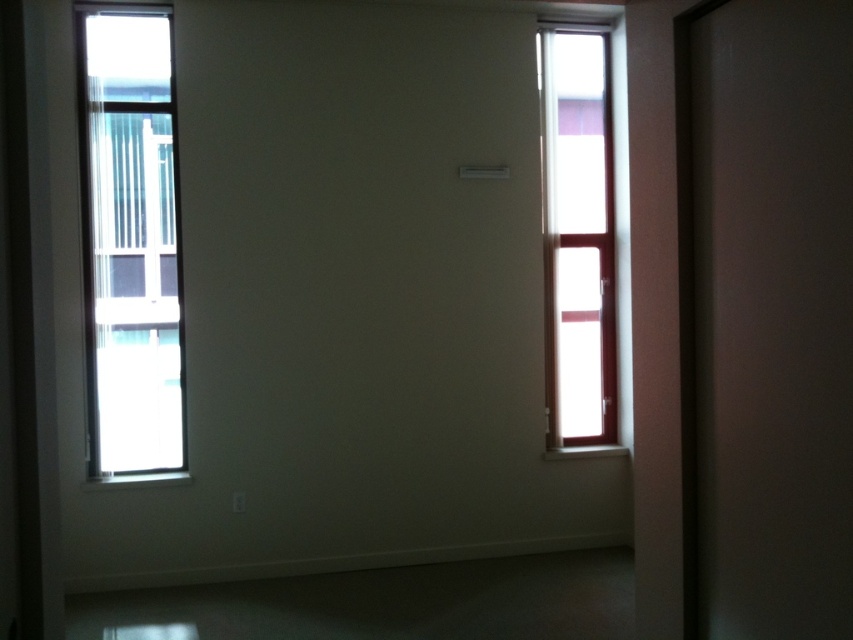
You are a delivery person with a package that requires a 1.5 meter clearance to deliver. You need to pass through the transparent glass screen door at right and the camera. Can you safely navigate through the space between them?

The transparent glass screen door at right and camera are 1.45 meters apart from each other, so the required 1.5 meter clearance is not available. The delivery person cannot safely navigate through the space between them.

You are a delivery robot with a box that is 8 feet wide. You need to move through the space between the clear glass window at left and the clear glass window at right. Can your box fit through the space between them?

The clear glass window at left and clear glass window at right are 8.43 feet apart from each other. Since your box is 8 feet wide, it can fit through the space between them as there is enough clearance.